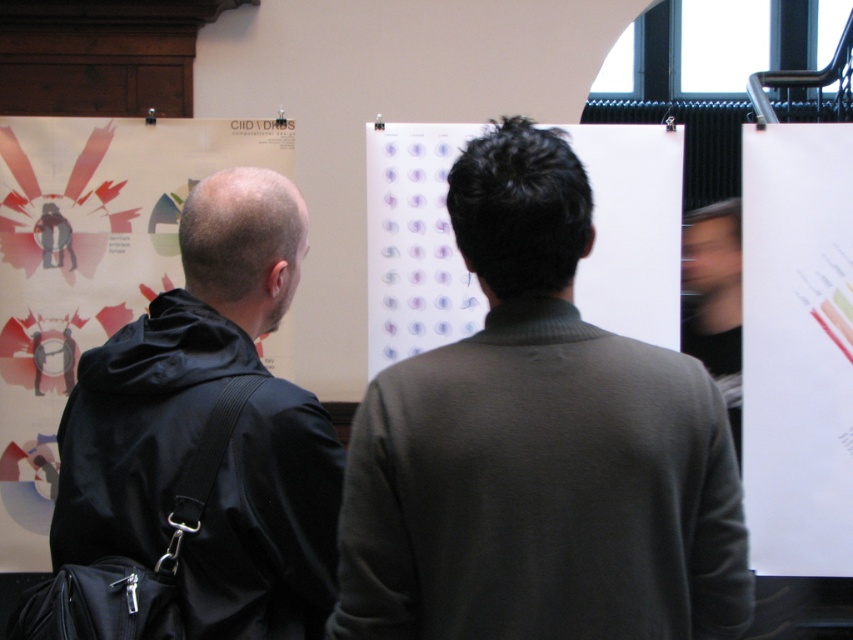
Question: Is white paper at right bigger than white paper at center?

Choices:
 (A) yes
 (B) no

Answer: (A)

Question: Is dark green sweater at center bigger than white paper at right?

Choices:
 (A) no
 (B) yes

Answer: (A)

Question: Which is farther from the black matte jacket at left?

Choices:
 (A) white paper at center
 (B) white paper at right
 (C) dark green sweater at center

Answer: (B)

Question: Which of the following is the closest to the observer?

Choices:
 (A) black matte jacket at left
 (B) dark green sweater at center

Answer: (B)

Question: Which is farther from the white paper at right?

Choices:
 (A) dark green sweater at center
 (B) black matte jacket at left
 (C) white paper at center

Answer: (B)

Question: Can you confirm if dark green sweater at center is positioned above white paper at center?

Choices:
 (A) yes
 (B) no

Answer: (B)